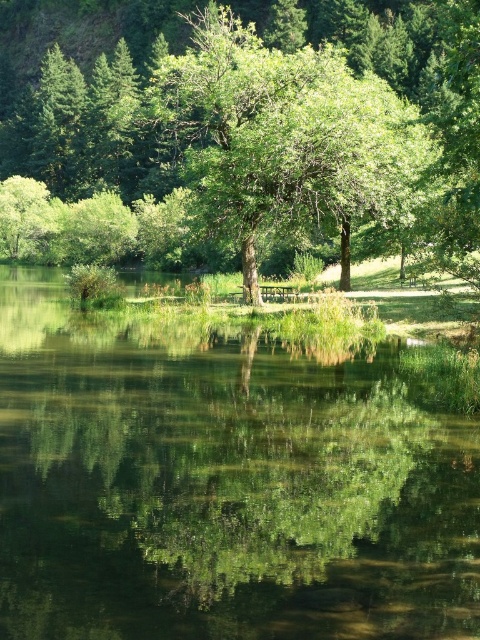
You are standing at the edge of the water in the serene natural scene. You notice a point marked at coordinates (222, 486). What object is located at this point?

The green reflective water at center is located at point (222, 486).

You are an artist trying to paint the scene. You need to decide the vertical placement of the green reflective water at center and the green leafy tree at center. Which one should be placed lower on the canvas?

The green reflective water at center should be placed lower on the canvas because it has a lesser height compared to the green leafy tree at center, which is taller.